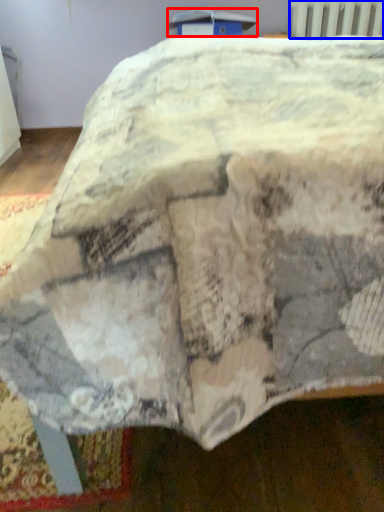
Question: Which point is further to the camera, table (highlighted by a red box) or radiator (highlighted by a blue box)?

Choices:
 (A) table
 (B) radiator

Answer: (B)